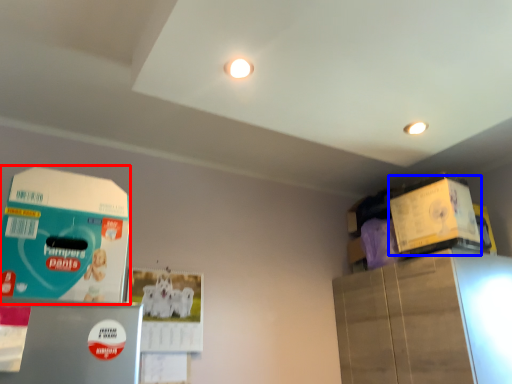
Question: Which point is closer to the camera, box (highlighted by a red box) or box (highlighted by a blue box)?

Choices:
 (A) box
 (B) box

Answer: (A)